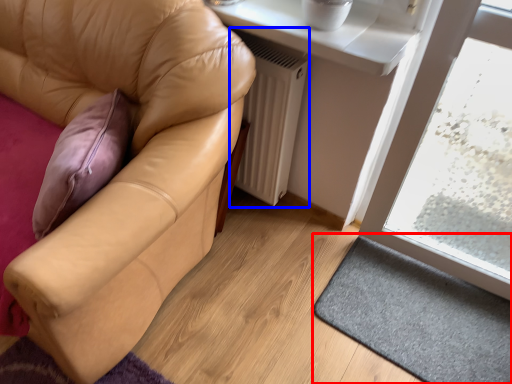
Question: Which object appears farthest to the camera in this image, doormat (highlighted by a red box) or radiator (highlighted by a blue box)?

Choices:
 (A) doormat
 (B) radiator

Answer: (B)